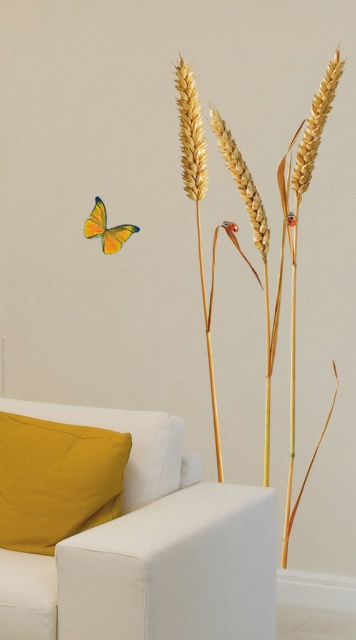
Who is higher up, dry wheat stalks at center or yellow-green matte butterfly at lower left?

yellow-green matte butterfly at lower left

From the picture: Between dry wheat stalks at center and yellow-green matte butterfly at lower left, which one appears on the left side from the viewer's perspective?

yellow-green matte butterfly at lower left

Identify the location of dry wheat stalks at center. (296, 220).

Measure the distance between mustard fabric pillow at lower left and yellow-green matte butterfly at lower left.

mustard fabric pillow at lower left is 1.64 meters away from yellow-green matte butterfly at lower left.

Which is more to the right, mustard fabric pillow at lower left or yellow-green matte butterfly at lower left?

mustard fabric pillow at lower left is more to the right.

Identify the location of mustard fabric pillow at lower left. This screenshot has height=640, width=356. (56, 481).

Between white fabric couch at lower left and dry wheat stalks at center, which one is positioned higher?

dry wheat stalks at center

Is white fabric couch at lower left wider than dry wheat stalks at center?

Yes, white fabric couch at lower left is wider than dry wheat stalks at center.

I want to click on white fabric couch at lower left, so click(149, 548).